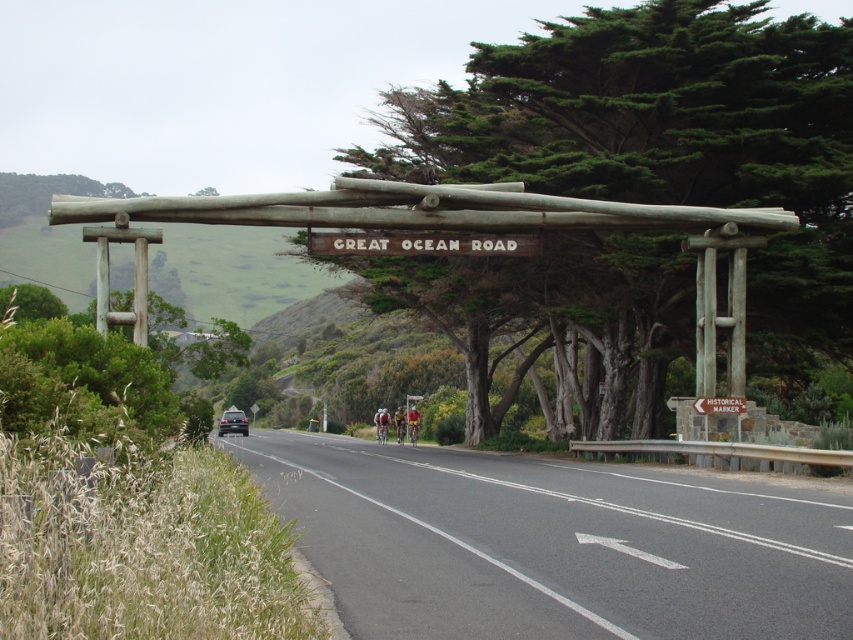
Looking at this image, does black asphalt road at center come in front of yellow fabric helmet at center?

Yes, it is in front of yellow fabric helmet at center.

Describe the element at coordinates (552, 545) in the screenshot. I see `black asphalt road at center` at that location.

Identify the location of black asphalt road at center. Image resolution: width=853 pixels, height=640 pixels. (552, 545).

Is white painted wood sign at center bigger than yellow fabric helmet at center?

No, white painted wood sign at center is not bigger than yellow fabric helmet at center.

Is white painted wood sign at center above yellow fabric helmet at center?

Yes, white painted wood sign at center is above yellow fabric helmet at center.

Locate an element on the screen. The image size is (853, 640). white painted wood sign at center is located at coordinates (421, 243).

Between black asphalt road at center and shiny black sedan at center, which one has less height?

shiny black sedan at center

Who is lower down, black asphalt road at center or shiny black sedan at center?

shiny black sedan at center is below.

Identify the location of black asphalt road at center. The width and height of the screenshot is (853, 640). (552, 545).

Where is `black asphalt road at center`? The image size is (853, 640). black asphalt road at center is located at coordinates (552, 545).